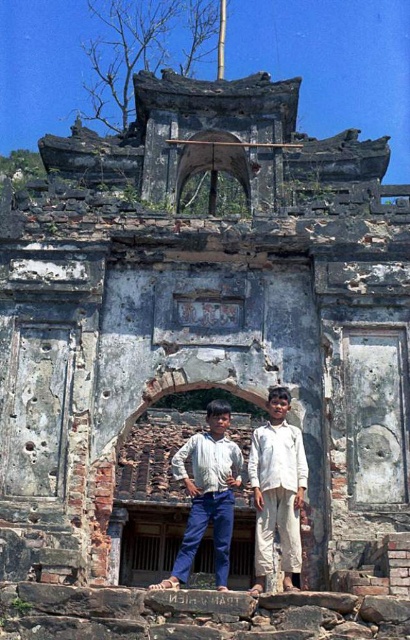
You are a photographer aiming to capture the two individuals in front of the dilapidated structure. Since both the white cotton pants at center and the white cotton shirt at center are part of their outfit, where should you focus your camera to ensure both are visible in the frame?

The white cotton pants at center is located below the white cotton shirt at center, so focusing on the middle of the individuals will ensure both the white cotton pants at center and the white cotton shirt at center are visible in the frame.

You are a photographer trying to capture the white cotton pants at center in the image. The pants are located at point (x=277, y=490). Where should you position your camera to ensure the pants are centered in the frame?

To center the white cotton pants at center in the frame, position your camera directly facing the point (x=277, y=490), ensuring the pants are at the center of your viewfinder.

You are a photographer trying to capture the two people in the image. You want to ensure that both the white cotton pants at center and the white cotton shirt at center are clearly visible in your shot. Based on their positions, which one should you focus on first to ensure proper framing?

You should focus on the white cotton shirt at center first because the white cotton pants at center are to the left of it, so adjusting the frame to include the shirt ensures the pants will also be in view.